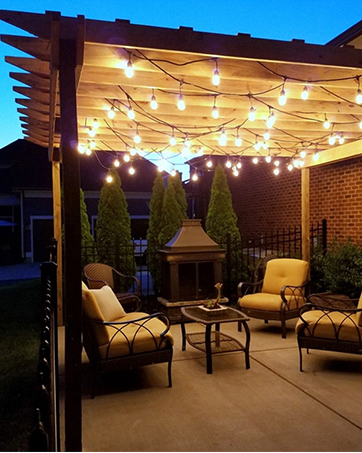
This screenshot has width=362, height=453. I want to click on pillow, so click(x=108, y=301).